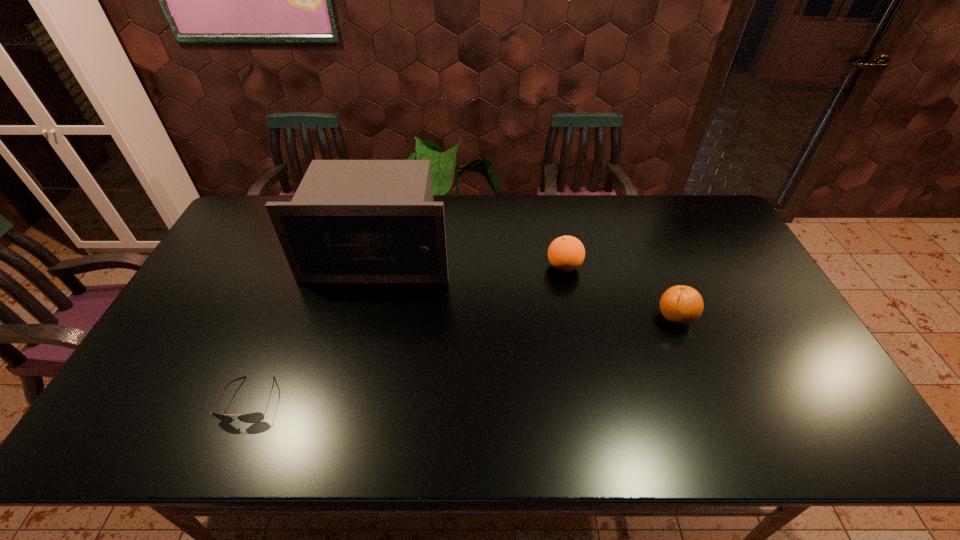
In order to click on vacant space that is in between the sunglasses and the microwave oven in this screenshot , I will do `click(315, 328)`.

Locate an element on the screen. empty space that is in between the farther orange and the tallest object is located at coordinates (471, 261).

Locate an element on the screen. unoccupied position between the right orange and the shortest object is located at coordinates click(x=463, y=359).

Locate an element on the screen. The image size is (960, 540). vacant area that lies between the second object from right to left and the tallest object is located at coordinates (471, 261).

Find the location of a particular element. Image resolution: width=960 pixels, height=540 pixels. free spot between the right orange and the microwave oven is located at coordinates (527, 287).

Image resolution: width=960 pixels, height=540 pixels. Identify the location of free spot between the farther orange and the shortest object. (407, 333).

Where is `unoccupied position between the microwave oven and the third farthest object`? This screenshot has height=540, width=960. unoccupied position between the microwave oven and the third farthest object is located at coordinates tap(527, 287).

The image size is (960, 540). What are the coordinates of `free area in between the left orange and the microwave oven` in the screenshot? It's located at (471, 261).

Identify which object is the second closest to the sunglasses. Please provide its 2D coordinates. Your answer should be formatted as a tuple, i.e. [(x, y)], where the tuple contains the x and y coordinates of a point satisfying the conditions above.

[(566, 253)]

Find the location of a particular element. The image size is (960, 540). object that is the second closest one to the left orange is located at coordinates (350, 221).